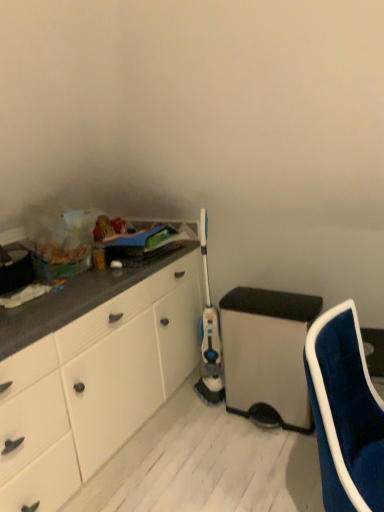
Describe the element at coordinates (267, 354) in the screenshot. I see `matte plastic trash can at lower right` at that location.

Identify the location of matte plastic trash can at lower right. This screenshot has height=512, width=384. (267, 354).

Measure the distance between point (258,398) and camera.

8.06 feet.

The width and height of the screenshot is (384, 512). In order to click on velvet blue chair at lower right in this screenshot , I will do `click(345, 413)`.

What do you see at coordinates (345, 413) in the screenshot?
I see `velvet blue chair at lower right` at bounding box center [345, 413].

Based on the photo, what is the approximate height of velvet blue chair at lower right?

velvet blue chair at lower right is 37.06 inches tall.

At what (x,y) coordinates should I click in order to perform the action: click on matte plastic trash can at lower right. Please return your answer as a coordinate pair (x, y). Image resolution: width=384 pixels, height=512 pixels. Looking at the image, I should click on (267, 354).

Considering the positions of objects matte plastic trash can at lower right and velvet blue chair at lower right in the image provided, who is more to the left, matte plastic trash can at lower right or velvet blue chair at lower right?

From the viewer's perspective, matte plastic trash can at lower right appears more on the left side.

In the image, is matte plastic trash can at lower right positioned in front of or behind velvet blue chair at lower right?

Visually, matte plastic trash can at lower right is located behind velvet blue chair at lower right.

Which is less distant, (300,329) or (333,452)?

Point (300,329).

From the image's perspective, who appears lower, matte plastic trash can at lower right or velvet blue chair at lower right?

velvet blue chair at lower right appears lower in the image.

From a real-world perspective, is matte plastic trash can at lower right physically located above or below velvet blue chair at lower right?

In terms of real-world spatial position, matte plastic trash can at lower right is below velvet blue chair at lower right.

Can you confirm if matte plastic trash can at lower right is wider than velvet blue chair at lower right?

Yes, matte plastic trash can at lower right is wider than velvet blue chair at lower right.

Considering the relative sizes of matte plastic trash can at lower right and velvet blue chair at lower right in the image provided, is matte plastic trash can at lower right shorter than velvet blue chair at lower right?

Yes.

Consider the image. Considering the sizes of objects matte plastic trash can at lower right and velvet blue chair at lower right in the image provided, who is bigger, matte plastic trash can at lower right or velvet blue chair at lower right?

Bigger between the two is velvet blue chair at lower right.

Is matte plastic trash can at lower right spatially inside velvet blue chair at lower right, or outside of it?

matte plastic trash can at lower right exists outside the volume of velvet blue chair at lower right.

Is matte plastic trash can at lower right far away from velvet blue chair at lower right?

matte plastic trash can at lower right is near velvet blue chair at lower right, not far away.

Is matte plastic trash can at lower right looking in the opposite direction of velvet blue chair at lower right?

No.

What's the angular difference between matte plastic trash can at lower right and velvet blue chair at lower right's facing directions?

They differ by 92.4 degrees in their facing directions.

Measure the distance between matte plastic trash can at lower right and velvet blue chair at lower right.

matte plastic trash can at lower right is 30.85 inches from velvet blue chair at lower right.

Where is `appliance below the velvet blue chair at lower right (from a real-world perspective)`? Image resolution: width=384 pixels, height=512 pixels. appliance below the velvet blue chair at lower right (from a real-world perspective) is located at coordinates (267, 354).

Which is more to the left, velvet blue chair at lower right or matte plastic trash can at lower right?

Positioned to the left is matte plastic trash can at lower right.

Considering their positions, is velvet blue chair at lower right located in front of or behind matte plastic trash can at lower right?

velvet blue chair at lower right is positioned closer to the viewer than matte plastic trash can at lower right.

Is point (332, 484) positioned in front of point (236, 316)?

Yes.

Based on the photo, from the image's perspective, who appears lower, velvet blue chair at lower right or matte plastic trash can at lower right?

velvet blue chair at lower right.

From a real-world perspective, who is located higher, velvet blue chair at lower right or matte plastic trash can at lower right?

velvet blue chair at lower right.

Considering the relative sizes of velvet blue chair at lower right and matte plastic trash can at lower right in the image provided, is velvet blue chair at lower right thinner than matte plastic trash can at lower right?

Yes, velvet blue chair at lower right is thinner than matte plastic trash can at lower right.

Considering the sizes of velvet blue chair at lower right and matte plastic trash can at lower right in the image, is velvet blue chair at lower right taller or shorter than matte plastic trash can at lower right?

velvet blue chair at lower right is taller than matte plastic trash can at lower right.

From the picture: Considering the relative sizes of velvet blue chair at lower right and matte plastic trash can at lower right in the image provided, is velvet blue chair at lower right smaller than matte plastic trash can at lower right?

No, velvet blue chair at lower right is not smaller than matte plastic trash can at lower right.

Is velvet blue chair at lower right spatially inside matte plastic trash can at lower right, or outside of it?

velvet blue chair at lower right is not enclosed by matte plastic trash can at lower right.

Are velvet blue chair at lower right and matte plastic trash can at lower right beside each other?

No, velvet blue chair at lower right is not next to matte plastic trash can at lower right.

Is velvet blue chair at lower right positioned with its back to matte plastic trash can at lower right?

No, matte plastic trash can at lower right is not at the back of velvet blue chair at lower right.

Find the location of a particular element. appliance that is behind the velvet blue chair at lower right is located at coordinates (267, 354).

You are a GUI agent. You are given a task and a screenshot of the screen. Output one action in this format:
    pyautogui.click(x=<x>, y=<y>)
    Task: Click on the chair located in front of the matte plastic trash can at lower right
    
    Given the screenshot: What is the action you would take?
    pyautogui.click(x=345, y=413)

I want to click on appliance behind the velvet blue chair at lower right, so click(267, 354).